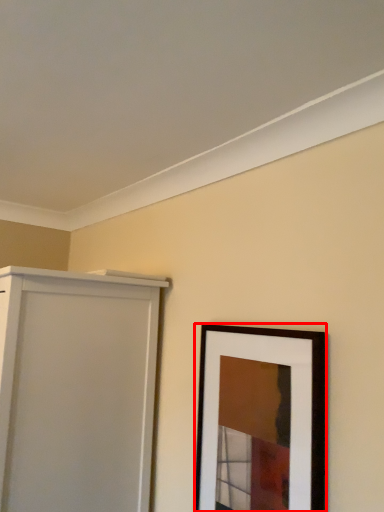
Question: Considering the relative positions of picture frame (annotated by the red box) and door in the image provided, where is picture frame (annotated by the red box) located with respect to the staircase?

Choices:
 (A) left
 (B) right

Answer: (B)